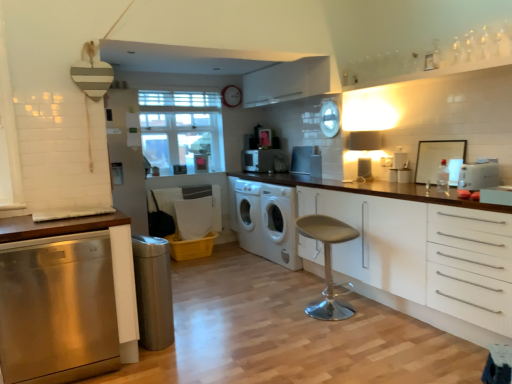
Question: Would you say white glossy microwave at center, acting as the fifth appliance starting from the front, contains satin silver trash can at lower left, which is the 1th appliance from bottom to top?

Choices:
 (A) no
 (B) yes

Answer: (A)

Question: Can you confirm if white glossy microwave at center, the 1th appliance when ordered from back to front, is smaller than satin silver trash can at lower left, which is the fifth appliance in top-to-bottom order?

Choices:
 (A) yes
 (B) no

Answer: (A)

Question: Can you confirm if white glossy microwave at center, the second appliance when ordered from left to right, is positioned to the left of satin silver trash can at lower left, marked as the first appliance in a front-to-back arrangement?

Choices:
 (A) yes
 (B) no

Answer: (B)

Question: Does white glossy microwave at center, acting as the fifth appliance starting from the bottom, lie in front of satin silver trash can at lower left, which is the 1th appliance from bottom to top?

Choices:
 (A) no
 (B) yes

Answer: (A)

Question: Is satin silver trash can at lower left, the 5th appliance viewed from the back, at the back of white glossy microwave at center, the second appliance when ordered from left to right?

Choices:
 (A) yes
 (B) no

Answer: (B)

Question: From the image's perspective, is clear glass window at center above or below stainless steel dishwasher at left, arranged as the first cabinetry when viewed from the left?

Choices:
 (A) above
 (B) below

Answer: (A)

Question: Considering the positions of clear glass window at center and stainless steel dishwasher at left, arranged as the first cabinetry when viewed from the left, in the image, is clear glass window at center taller or shorter than stainless steel dishwasher at left, arranged as the first cabinetry when viewed from the left,?

Choices:
 (A) short
 (B) tall

Answer: (B)

Question: In terms of size, does clear glass window at center appear bigger or smaller than stainless steel dishwasher at left, which appears as the second cabinetry when viewed from the right?

Choices:
 (A) small
 (B) big

Answer: (A)

Question: Considering the relative positions of clear glass window at center and stainless steel dishwasher at left, arranged as the first cabinetry when viewed from the left, in the image provided, is clear glass window at center to the left or to the right of stainless steel dishwasher at left, arranged as the first cabinetry when viewed from the left,?

Choices:
 (A) left
 (B) right

Answer: (B)

Question: From the image's perspective, is white glossy toaster at upper right, which is the 3th appliance in back-to-front order, above or below white matte cabinet at right, marked as the first cabinetry in a right-to-left arrangement?

Choices:
 (A) above
 (B) below

Answer: (A)

Question: Considering their positions, is white glossy toaster at upper right, the 4th appliance positioned from the left, located in front of or behind white matte cabinet at right, marked as the first cabinetry in a right-to-left arrangement?

Choices:
 (A) front
 (B) behind

Answer: (B)

Question: Looking at their shapes, would you say white glossy toaster at upper right, which appears as the second appliance when viewed from the right, is wider or thinner than white matte cabinet at right, marked as the first cabinetry in a right-to-left arrangement?

Choices:
 (A) wide
 (B) thin

Answer: (B)

Question: From a real-world perspective, relative to white matte cabinet at right, marked as the first cabinetry in a right-to-left arrangement, is white glossy toaster at upper right, which is the 3th appliance in back-to-front order, vertically above or below?

Choices:
 (A) above
 (B) below

Answer: (A)

Question: In terms of size, does stainless steel dishwasher at left, arranged as the first cabinetry when viewed from the left, appear bigger or smaller than satin silver toaster at center, the 3th appliance in the left-to-right sequence?

Choices:
 (A) small
 (B) big

Answer: (B)

Question: In the image, is stainless steel dishwasher at left, arranged as the first cabinetry when viewed from the left, on the left side or the right side of satin silver toaster at center, the 3th appliance in the left-to-right sequence?

Choices:
 (A) left
 (B) right

Answer: (A)